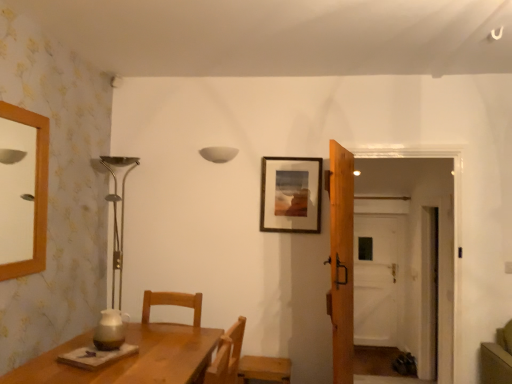
You are a GUI agent. You are given a task and a screenshot of the screen. Output one action in this format:
    pyautogui.click(x=<x>, y=<y>)
    Task: Click on the free space above transparent glass door at center (from a real-world perspective)
    
    Given the screenshot: What is the action you would take?
    pyautogui.click(x=382, y=211)